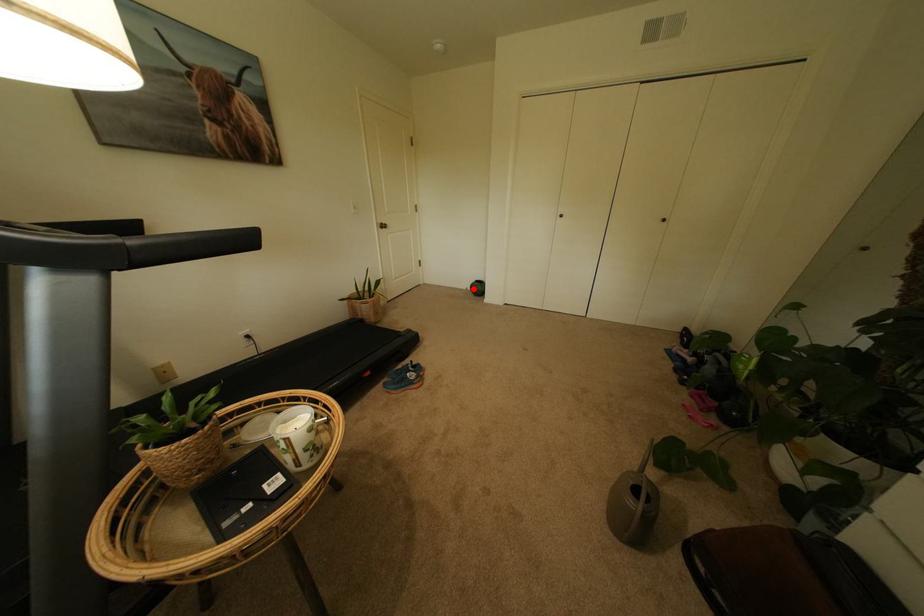
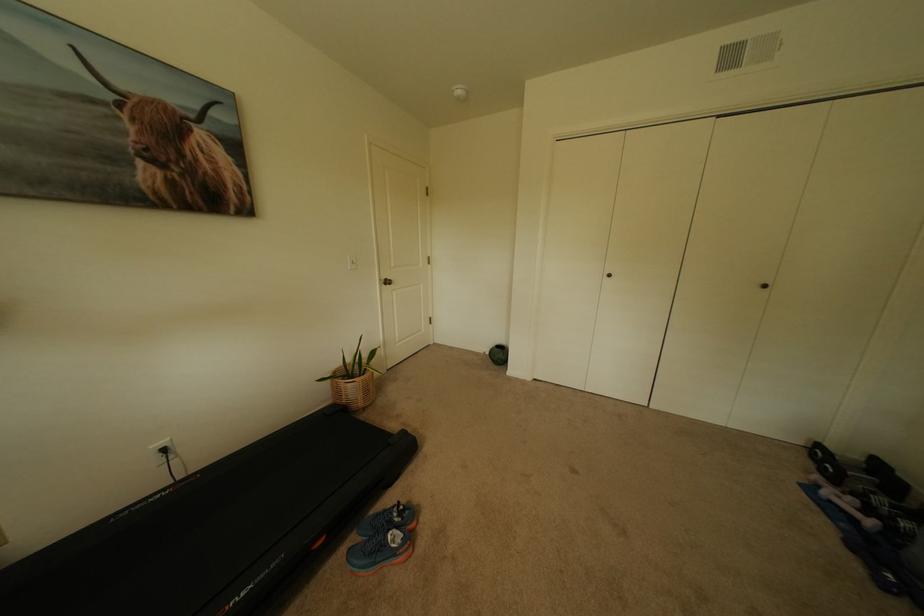
In the second image, find the point that corresponds to the highlighted location in the first image.

(491, 353)